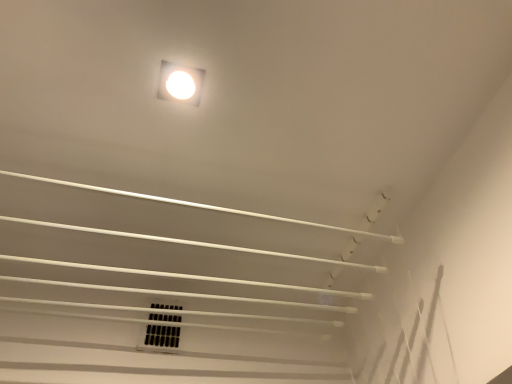
Question: Looking at the image, does black plastic vent at center seem bigger or smaller compared to white glossy light fixture at upper center?

Choices:
 (A) small
 (B) big

Answer: (B)

Question: Choose the correct answer: Is black plastic vent at center inside white glossy light fixture at upper center or outside it?

Choices:
 (A) inside
 (B) outside

Answer: (B)

Question: Is point pyautogui.click(x=164, y=322) positioned closer to the camera than point pyautogui.click(x=200, y=77)?

Choices:
 (A) closer
 (B) farther

Answer: (B)

Question: Considering the relative positions of white glossy light fixture at upper center and black plastic vent at center in the image provided, is white glossy light fixture at upper center to the left or to the right of black plastic vent at center?

Choices:
 (A) right
 (B) left

Answer: (A)

Question: Choose the correct answer: Is white glossy light fixture at upper center inside black plastic vent at center or outside it?

Choices:
 (A) inside
 (B) outside

Answer: (B)

Question: Is white glossy light fixture at upper center bigger or smaller than black plastic vent at center?

Choices:
 (A) big
 (B) small

Answer: (B)

Question: From the image's perspective, relative to black plastic vent at center, is white glossy light fixture at upper center above or below?

Choices:
 (A) below
 (B) above

Answer: (B)